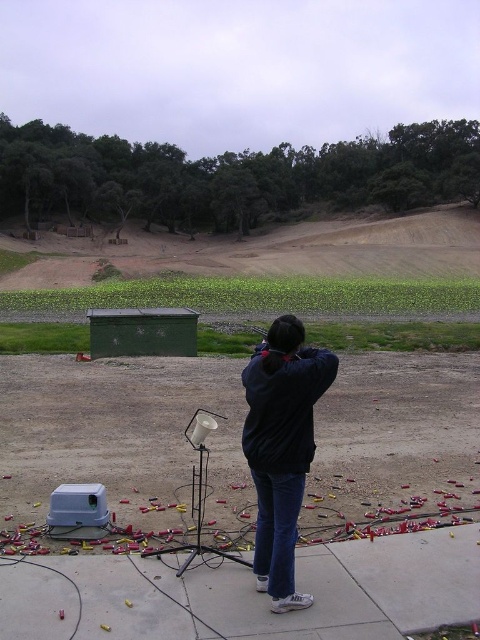
Measure the distance between point (x=348, y=256) and camera.

Point (x=348, y=256) and camera are 218.75 feet apart.

The width and height of the screenshot is (480, 640). Find the location of `brown dirt field at upper center`. brown dirt field at upper center is located at coordinates (272, 252).